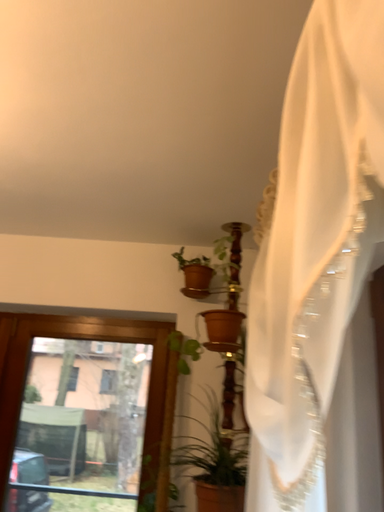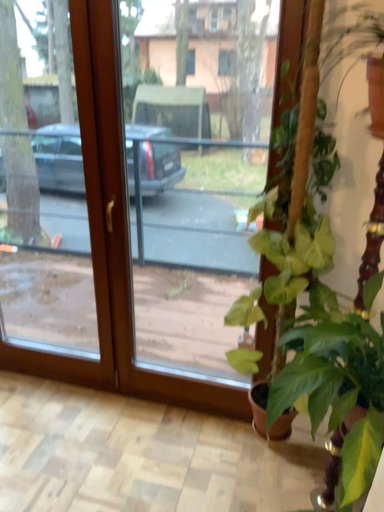
Question: Which way did the camera rotate in the video?

Choices:
 (A) rotated right
 (B) rotated left

Answer: (B)